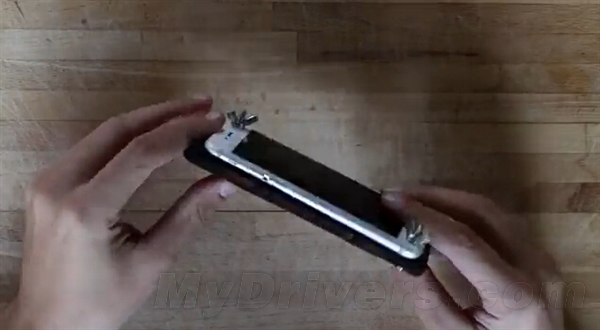
Where is `empty space on top right of table`? The height and width of the screenshot is (330, 600). empty space on top right of table is located at coordinates (485, 35).